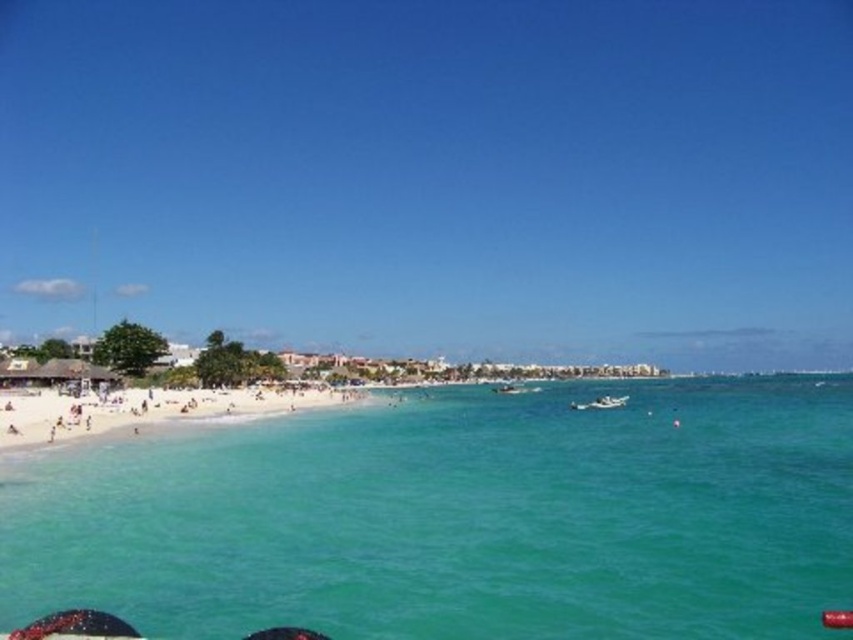
You are standing on the beach and want to take a photo of the white glossy boat at lower center without any obstructions. Based on the scene, will the clear blue water at beach center block your view of the boat?

The clear blue water at beach center is closer to the viewer than the white glossy boat at lower center. Therefore, the clear blue water at beach center will block your view of the boat.

You are standing on the white sand beach at lower left and want to reach the clear blue water at beach center. Which direction should you walk to get there?

You should walk to the right because the clear blue water at beach center is located to the right of the white sand beach at lower left.

You are planning to set up a small tent on the white sand beach at lower left and the white glossy boat at lower center. Which location would allow you to place the tent without it being too cramped?

The white sand beach at lower left is larger in size than the white glossy boat at lower center, so placing the tent on the white sand beach at lower left would provide more space and prevent it from being too cramped.